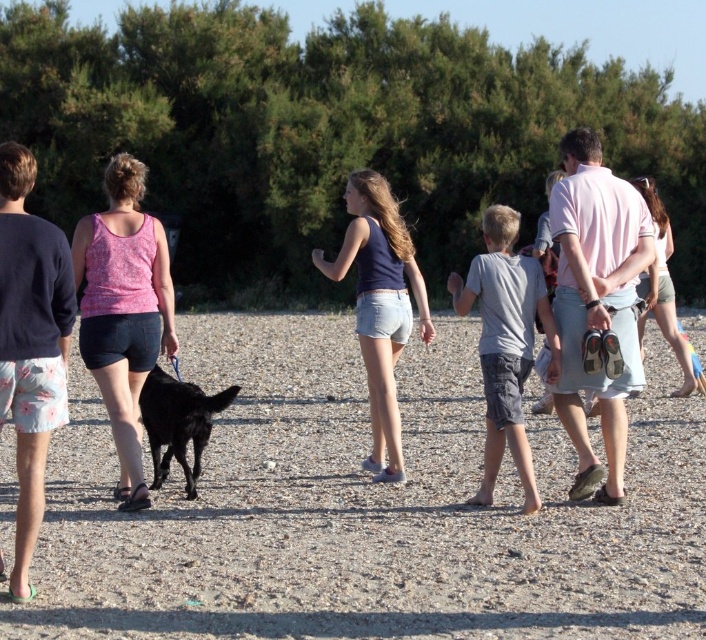
You are standing at the point with coordinates point (520, 632) and want to walk towards the point with coordinates point (136, 332). Given the scene described, will you be moving closer to or further away from the camera as you walk?

Since point (520, 632) is closer to the camera than point (136, 332), walking from point (520, 632) towards point (136, 332) means you will be moving further away from the camera.